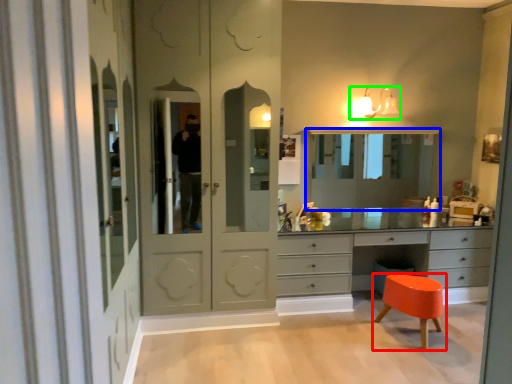
Question: Which object is the closest to the stool (highlighted by a red box)? Choose among these: medicine cabinet (highlighted by a blue box) or light fixture (highlighted by a green box).

Choices:
 (A) medicine cabinet
 (B) light fixture

Answer: (A)